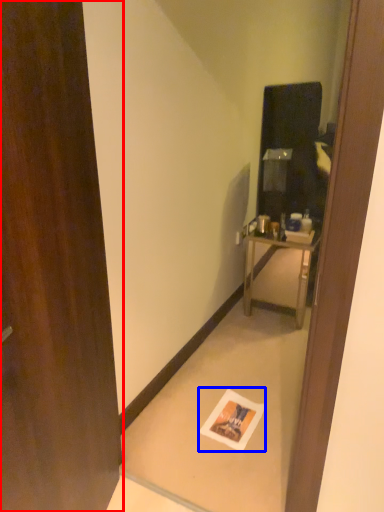
Question: Which object is closer to the camera taking this photo, door (highlighted by a red box) or postcard (highlighted by a blue box)?

Choices:
 (A) door
 (B) postcard

Answer: (A)